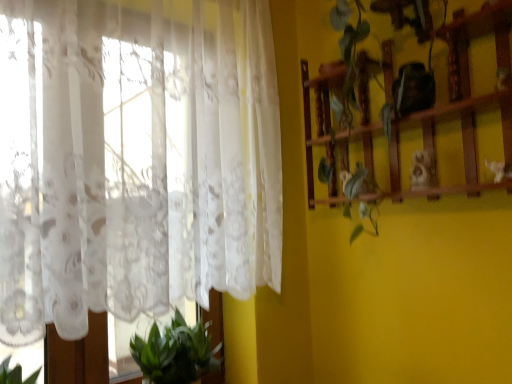
In order to click on wooden shelf at right in this screenshot , I will do `click(461, 104)`.

Based on the photo, which point is more distant from viewer, (202, 327) or (275, 221)?

The point (202, 327) is more distant.

From the picture: Considering the relative positions of green leafy plant at lower left and white lace curtain at left in the image provided, is green leafy plant at lower left in front of white lace curtain at left?

No, the depth of green leafy plant at lower left is greater than that of white lace curtain at left.

Identify the location of curtain above the green leafy plant at lower left (from the image's perspective). (133, 162).

Is green leafy plant at lower left oriented away from white lace curtain at left?

No, green leafy plant at lower left is not facing away from white lace curtain at left.

From the image's perspective, does white lace curtain at left appear lower than wooden shelf at right?

Indeed, from the image's perspective, white lace curtain at left is shown beneath wooden shelf at right.

From a real-world perspective, does white lace curtain at left stand above wooden shelf at right?

Actually, white lace curtain at left is physically below wooden shelf at right in the real world.

Considering the sizes of objects white lace curtain at left and wooden shelf at right in the image provided, who is wider, white lace curtain at left or wooden shelf at right?

With larger width is white lace curtain at left.

Could you tell me if white lace curtain at left is facing wooden shelf at right?

Yes, white lace curtain at left is aimed at wooden shelf at right.

From the image's perspective, would you say wooden shelf at right is shown under white lace curtain at left?

No, from the image's perspective, wooden shelf at right is not beneath white lace curtain at left.

Is wooden shelf at right closer to the viewer compared to white lace curtain at left?

No, the depth of wooden shelf at right is greater than that of white lace curtain at left.

Is wooden shelf at right taller or shorter than white lace curtain at left?

In the image, wooden shelf at right appears to be shorter than white lace curtain at left.

Could you tell me if wooden shelf at right is turned towards white lace curtain at left?

Yes.

Is point (77, 253) in front of point (204, 336)?

Yes, point (77, 253) is in front of point (204, 336).

Between white lace curtain at left and green leafy plant at lower left, which one is positioned behind?

green leafy plant at lower left is behind.

Between white lace curtain at left and green leafy plant at lower left, which one has smaller width?

With smaller width is white lace curtain at left.

Is white lace curtain at left not near green leafy plant at lower left?

No, white lace curtain at left is not far away from green leafy plant at lower left.

Is the position of wooden shelf at right less distant than that of green leafy plant at lower left?

Yes, it is.

Is wooden shelf at right touching green leafy plant at lower left?

No, wooden shelf at right is not in contact with green leafy plant at lower left.

From the picture: From a real-world perspective, is wooden shelf at right physically located above or below green leafy plant at lower left?

wooden shelf at right is situated higher than green leafy plant at lower left in the real world.

Between wooden shelf at right and green leafy plant at lower left, which one has smaller width?

wooden shelf at right is thinner.

What's the angular difference between green leafy plant at lower left and wooden shelf at right's facing directions?

90 degrees.

From the image's perspective, is green leafy plant at lower left beneath wooden shelf at right?

Indeed, from the image's perspective, green leafy plant at lower left is shown beneath wooden shelf at right.

Is wooden shelf at right completely or partially inside green leafy plant at lower left?

No, wooden shelf at right is not a part of green leafy plant at lower left.

Is green leafy plant at lower left to the right of wooden shelf at right from the viewer's perspective?

No, green leafy plant at lower left is not to the right of wooden shelf at right.

The height and width of the screenshot is (384, 512). What are the coordinates of `houseplant behind the white lace curtain at left` in the screenshot? It's located at (176, 352).

This screenshot has height=384, width=512. I want to click on shelf lying on the right of white lace curtain at left, so click(x=461, y=104).

Based on their spatial positions, is white lace curtain at left or green leafy plant at lower left closer to wooden shelf at right?

white lace curtain at left is positioned closer to the anchor wooden shelf at right.

Considering their positions, is green leafy plant at lower left positioned further to white lace curtain at left than wooden shelf at right?

wooden shelf at right.

Estimate the real-world distances between objects in this image. Which object is closer to green leafy plant at lower left, wooden shelf at right or white lace curtain at left?

white lace curtain at left is positioned closer to the anchor green leafy plant at lower left.

Which object lies further to the anchor point wooden shelf at right, green leafy plant at lower left or white lace curtain at left?

green leafy plant at lower left is positioned further to the anchor wooden shelf at right.

From the image, which object appears to be farther from green leafy plant at lower left, white lace curtain at left or wooden shelf at right?

wooden shelf at right.

Considering their positions, is wooden shelf at right positioned further to white lace curtain at left than green leafy plant at lower left?

wooden shelf at right is positioned further to the anchor white lace curtain at left.

Locate an element on the screen. The image size is (512, 384). curtain between wooden shelf at right and green leafy plant at lower left in the vertical direction is located at coordinates (133, 162).